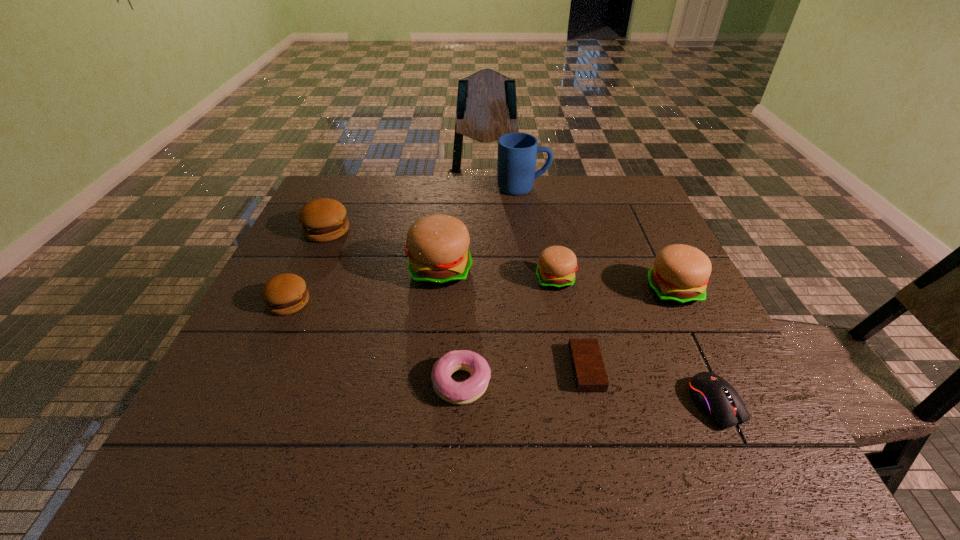
Where is `the fourth shortest object`? the fourth shortest object is located at coordinates tap(284, 294).

The image size is (960, 540). What are the coordinates of `the nearer brown hamburger` in the screenshot? It's located at point(284,294).

The height and width of the screenshot is (540, 960). In order to click on computer mouse in this screenshot , I will do `click(711, 393)`.

Find the location of a particular element. pink doughnut is located at coordinates (469, 390).

Where is `the shortest object`? This screenshot has width=960, height=540. the shortest object is located at coordinates (589, 373).

Identify the location of alarm clock. (589, 373).

In order to click on free region located on the side of the farthest object with the handle in this screenshot , I will do `click(611, 188)`.

Locate an element on the screen. vacant space located 0.190m on the left of the third hamburger from left to right is located at coordinates (333, 271).

The height and width of the screenshot is (540, 960). In order to click on vacant position located 0.370m on the left of the rightmost hamburger in this screenshot , I will do `click(494, 291)`.

Identify the location of free space located 0.160m on the front of the farthest hamburger. The height and width of the screenshot is (540, 960). tap(303, 283).